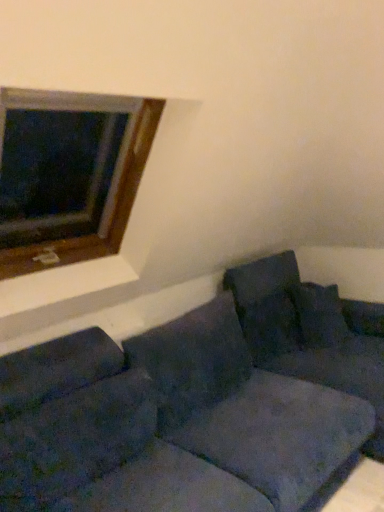
Question: Is velvety dark blue pillow at center, the second pillow from the right, taller or shorter than wooden frame at upper left?

Choices:
 (A) tall
 (B) short

Answer: (B)

Question: From a real-world perspective, is velvety dark blue pillow at center, the 2th pillow viewed from the left, above or below wooden frame at upper left?

Choices:
 (A) above
 (B) below

Answer: (B)

Question: Considering the real-world distances, which object is closest to the wooden frame at upper left?

Choices:
 (A) velvety dark blue pillow at center, the 2th pillow viewed from the left
 (B) velvety dark blue pillow at center, the first pillow viewed from the left
 (C) velvet dark blue pillow at right, which is the 3th pillow from left to right
 (D) velvet blue couch at lower right

Answer: (B)

Question: Which is farther from the velvet blue couch at lower right?

Choices:
 (A) velvety dark blue pillow at center, the third pillow from the right
 (B) wooden frame at upper left
 (C) velvety dark blue pillow at center, the 2th pillow viewed from the left
 (D) velvet dark blue pillow at right, which is the 3th pillow from left to right

Answer: (B)